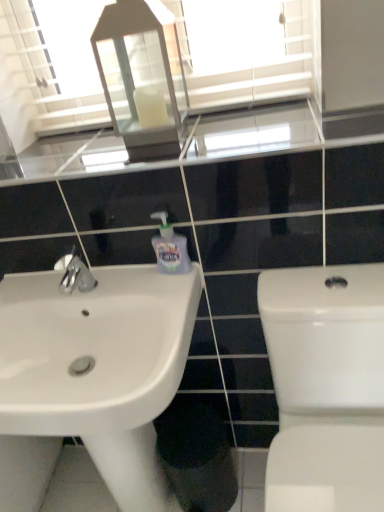
The height and width of the screenshot is (512, 384). Describe the element at coordinates (141, 73) in the screenshot. I see `white glass lantern at upper center` at that location.

What is the approximate width of white glossy toilet at right?

The width of white glossy toilet at right is 22.96 inches.

Describe the element at coordinates (91, 378) in the screenshot. Image resolution: width=384 pixels, height=512 pixels. I see `white glossy sink at lower left` at that location.

I want to click on translucent plastic soap dispenser at center, so click(x=170, y=248).

Is white glossy toilet at right taller or shorter than white glass lantern at upper center?

In the image, white glossy toilet at right appears to be taller than white glass lantern at upper center.

Based on the photo, which is correct: white glossy toilet at right is inside white glass lantern at upper center, or outside of it?

The correct answer is: outside.

Is white glossy toilet at right directly adjacent to white glass lantern at upper center?

white glossy toilet at right and white glass lantern at upper center are not in contact.

Where is `toilet below the translucent plastic soap dispenser at center (from the image's perspective)`? toilet below the translucent plastic soap dispenser at center (from the image's perspective) is located at coordinates (325, 387).

Is white glossy toilet at right bigger than translucent plastic soap dispenser at center?

Yes, white glossy toilet at right is bigger than translucent plastic soap dispenser at center.

Considering the relative sizes of white glossy toilet at right and translucent plastic soap dispenser at center in the image provided, is white glossy toilet at right taller than translucent plastic soap dispenser at center?

Indeed, white glossy toilet at right has a greater height compared to translucent plastic soap dispenser at center.

Is point (364, 370) farther from viewer compared to point (160, 347)?

Yes, point (364, 370) is behind point (160, 347).

Which object is positioned more to the right, white glossy toilet at right or white glossy sink at lower left?

white glossy toilet at right is more to the right.

Between white glossy toilet at right and white glossy sink at lower left, which one has smaller size?

white glossy sink at lower left is smaller.

Is white glossy toilet at right closer to the viewer compared to white glossy sink at lower left?

Yes.

Based on the photo, is white glossy sink at lower left placed right next to white glossy toilet at right?

white glossy sink at lower left and white glossy toilet at right are clearly separated.

Can you confirm if white glossy sink at lower left is positioned to the right of white glossy toilet at right?

No, white glossy sink at lower left is not to the right of white glossy toilet at right.

Is white glossy sink at lower left facing towards white glossy toilet at right?

No, white glossy sink at lower left does not turn towards white glossy toilet at right.

From the picture: Is white glossy sink at lower left bigger than white glossy toilet at right?

No.

Which object is wider, clear glass mirror at upper center or white glass lantern at upper center?

white glass lantern at upper center is wider.

Which is nearer, [10,80] or [131,26]?

Point [10,80] appears to be farther away from the viewer than point [131,26].

From the picture: From a real-world perspective, relative to white glass lantern at upper center, is clear glass mirror at upper center vertically above or below?

Clearly, from a real-world perspective, clear glass mirror at upper center is above white glass lantern at upper center.

Are clear glass mirror at upper center and white glass lantern at upper center located far from each other?

Actually, clear glass mirror at upper center and white glass lantern at upper center are a little close together.

Is white glass lantern at upper center at the back of white glossy sink at lower left?

No, white glossy sink at lower left is not facing the opposite direction of white glass lantern at upper center.

Locate an element on the screen. The height and width of the screenshot is (512, 384). medicine cabinet lying on the right of white glossy sink at lower left is located at coordinates (141, 73).

Does white glossy sink at lower left have a greater width compared to white glass lantern at upper center?

Yes, white glossy sink at lower left is wider than white glass lantern at upper center.

From a real-world perspective, who is located lower, clear glass mirror at upper center or white glossy sink at lower left?

white glossy sink at lower left is physically lower.

Is clear glass mirror at upper center aimed at white glossy sink at lower left?

No, clear glass mirror at upper center is not aimed at white glossy sink at lower left.

Does clear glass mirror at upper center have a greater height compared to white glossy sink at lower left?

Correct, clear glass mirror at upper center is much taller as white glossy sink at lower left.

Locate an element on the screen. medicine cabinet that appears above the white glossy toilet at right (from the image's perspective) is located at coordinates click(141, 73).

Locate an element on the screen. This screenshot has height=512, width=384. toilet beneath the translucent plastic soap dispenser at center (from a real-world perspective) is located at coordinates (325, 387).

Looking at the image, which one is located closer to translucent plastic soap dispenser at center, clear glass mirror at upper center or white glossy toilet at right?

The object closer to translucent plastic soap dispenser at center is white glossy toilet at right.

Considering their positions, is white glossy toilet at right positioned further to translucent plastic soap dispenser at center than white glass lantern at upper center?

white glossy toilet at right.

Looking at the image, which one is located closer to clear glass mirror at upper center, white glossy toilet at right or translucent plastic soap dispenser at center?

The object closer to clear glass mirror at upper center is translucent plastic soap dispenser at center.

Which object lies nearer to the anchor point white glossy toilet at right, white glossy sink at lower left or clear glass mirror at upper center?

Based on the image, white glossy sink at lower left appears to be nearer to white glossy toilet at right.

Based on their spatial positions, is white glossy sink at lower left or white glass lantern at upper center closer to white glossy toilet at right?

white glossy sink at lower left.

Based on their spatial positions, is white glass lantern at upper center or clear glass mirror at upper center further from white glossy sink at lower left?

Based on the image, white glass lantern at upper center appears to be further to white glossy sink at lower left.

Based on their spatial positions, is white glossy sink at lower left or translucent plastic soap dispenser at center further from white glass lantern at upper center?

Based on the image, white glossy sink at lower left appears to be further to white glass lantern at upper center.

Considering their positions, is translucent plastic soap dispenser at center positioned closer to white glossy toilet at right than white glossy sink at lower left?

white glossy sink at lower left is closer to white glossy toilet at right.

Identify the location of cleaning product between clear glass mirror at upper center and white glossy toilet at right from top to bottom. The width and height of the screenshot is (384, 512). click(x=170, y=248).

Find the location of `medicine cabinet between clear glass mirror at upper center and white glossy toilet at right vertically`. medicine cabinet between clear glass mirror at upper center and white glossy toilet at right vertically is located at coordinates (141, 73).

Where is `cleaning product between white glass lantern at upper center and white glossy sink at lower left in the vertical direction`? The image size is (384, 512). cleaning product between white glass lantern at upper center and white glossy sink at lower left in the vertical direction is located at coordinates (170, 248).

This screenshot has height=512, width=384. Find the location of `medicine cabinet between clear glass mirror at upper center and white glossy sink at lower left from top to bottom`. medicine cabinet between clear glass mirror at upper center and white glossy sink at lower left from top to bottom is located at coordinates (141, 73).